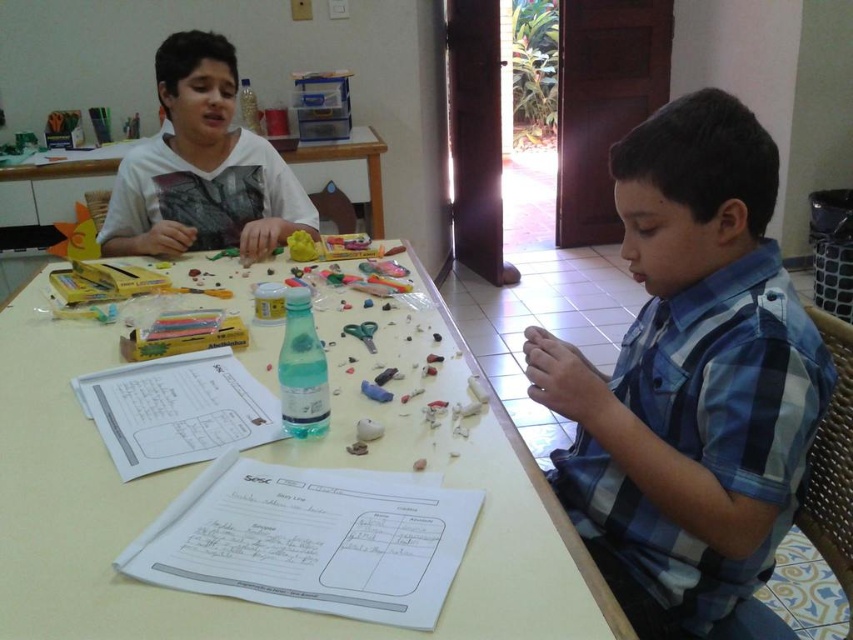
Question: Considering the relative positions of white plastic table at center and white matte shirt at upper left in the image provided, where is white plastic table at center located with respect to white matte shirt at upper left?

Choices:
 (A) right
 (B) left

Answer: (A)

Question: Is blue plaid shirt at right behind white plastic table at center?

Choices:
 (A) yes
 (B) no

Answer: (A)

Question: Which of the following is the closest to the observer?

Choices:
 (A) blue plaid shirt at right
 (B) white plastic table at center

Answer: (B)

Question: Is blue plaid shirt at right further to camera compared to white plastic table at center?

Choices:
 (A) no
 (B) yes

Answer: (B)

Question: Among these objects, which one is nearest to the camera?

Choices:
 (A) white matte shirt at upper left
 (B) white plastic table at center
 (C) white plastic table at upper left
 (D) blue plaid shirt at right

Answer: (B)

Question: Which of the following is the farthest from the observer?

Choices:
 (A) white plastic table at center
 (B) white plastic table at upper left
 (C) blue plaid shirt at right
 (D) white matte shirt at upper left

Answer: (B)